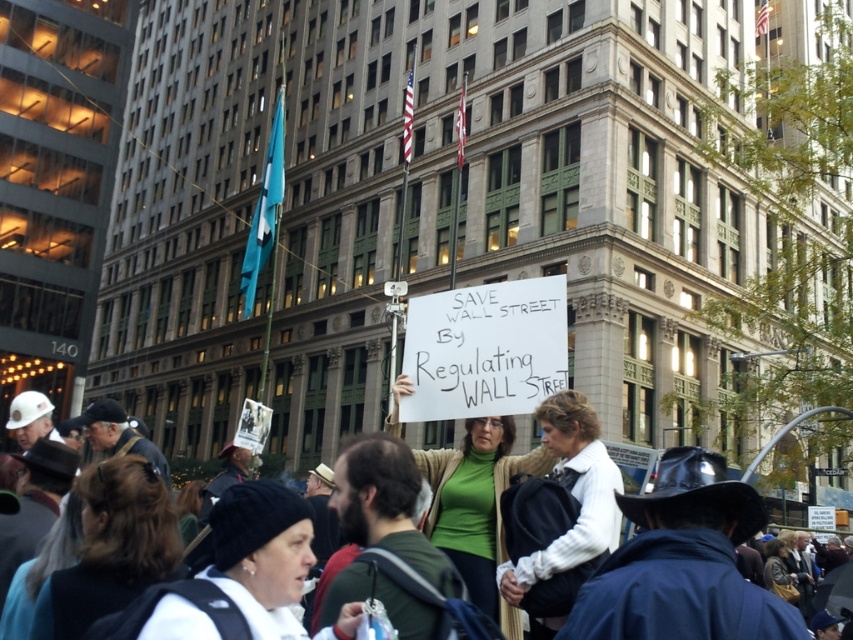
Looking at this image, does white fleece jacket at lower left appear on the left side of white matte jacket at center?

Yes, white fleece jacket at lower left is to the left of white matte jacket at center.

Between point (283, 508) and point (502, 595), which one is positioned in front?

Point (283, 508)

The image size is (853, 640). What are the coordinates of `white fleece jacket at lower left` in the screenshot? It's located at (260, 554).

Is white matte jacket at center taller than green sweater at center?

Incorrect, white matte jacket at center's height is not larger of green sweater at center's.

Is white matte jacket at center closer to the viewer compared to green sweater at center?

Yes, white matte jacket at center is in front of green sweater at center.

Is point (605, 497) more distant than point (788, 577)?

No, (605, 497) is closer to viewer.

The height and width of the screenshot is (640, 853). I want to click on white matte jacket at center, so [x=572, y=493].

Is white fleece jacket at lower left positioned behind green jersey at center?

No, it is not.

How far apart are white fleece jacket at lower left and green jersey at center?

The distance of white fleece jacket at lower left from green jersey at center is 23.92 feet.

This screenshot has height=640, width=853. I want to click on white fleece jacket at lower left, so click(x=260, y=554).